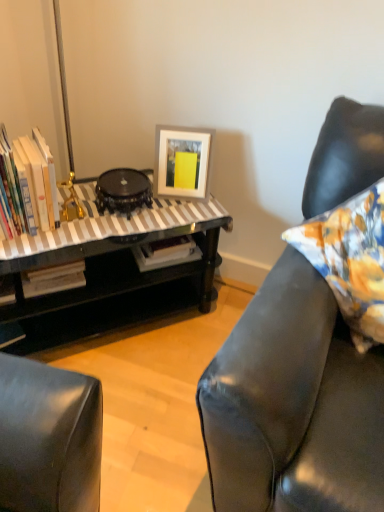
Question: From a real-world perspective, is black glossy round table at center positioned over black glossy table at left based on gravity?

Choices:
 (A) yes
 (B) no

Answer: (A)

Question: Is black glossy table at left located within black glossy round table at center?

Choices:
 (A) no
 (B) yes

Answer: (A)

Question: From the image's perspective, is black glossy round table at center beneath black glossy table at left?

Choices:
 (A) yes
 (B) no

Answer: (B)

Question: Could you tell me if black glossy round table at center is turned towards black glossy table at left?

Choices:
 (A) no
 (B) yes

Answer: (A)

Question: Is black glossy round table at center with black glossy table at left?

Choices:
 (A) no
 (B) yes

Answer: (A)

Question: Is the depth of black glossy round table at center less than that of black glossy table at left?

Choices:
 (A) no
 (B) yes

Answer: (A)

Question: From a real-world perspective, is white matte picture frame at upper center under black glossy round table at center?

Choices:
 (A) yes
 (B) no

Answer: (B)

Question: Can you confirm if white matte picture frame at upper center is shorter than black glossy round table at center?

Choices:
 (A) yes
 (B) no

Answer: (B)

Question: Is white matte picture frame at upper center not close to black glossy round table at center?

Choices:
 (A) no
 (B) yes

Answer: (A)

Question: Is black glossy round table at center completely or partially inside white matte picture frame at upper center?

Choices:
 (A) yes
 (B) no

Answer: (B)

Question: Is white matte picture frame at upper center thinner than black glossy round table at center?

Choices:
 (A) no
 (B) yes

Answer: (B)

Question: Considering the relative sizes of white matte picture frame at upper center and black glossy round table at center in the image provided, is white matte picture frame at upper center wider than black glossy round table at center?

Choices:
 (A) no
 (B) yes

Answer: (A)

Question: Considering the relative sizes of hardcover books at left and white matte picture frame at upper center in the image provided, is hardcover books at left smaller than white matte picture frame at upper center?

Choices:
 (A) yes
 (B) no

Answer: (B)